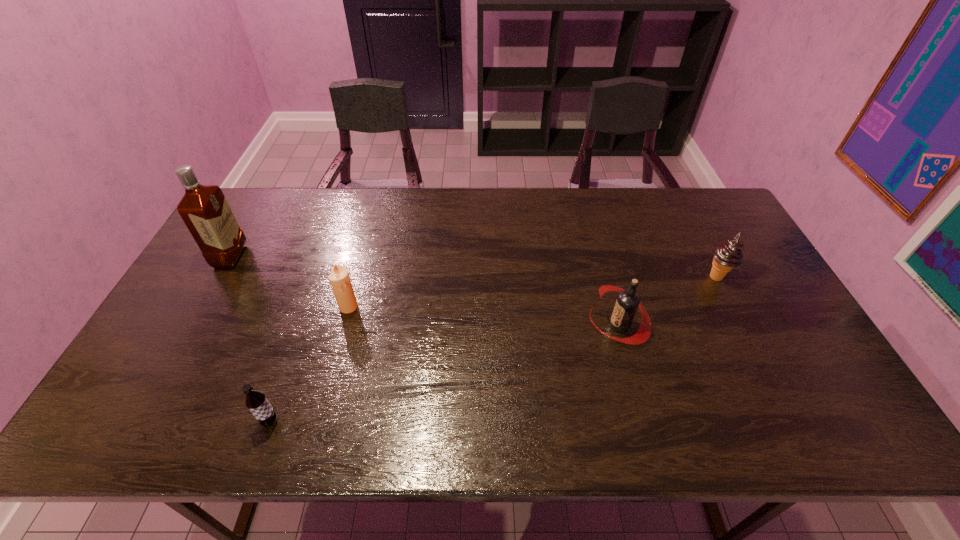
This screenshot has width=960, height=540. Identify the location of free spot between the nearer root beer and the tallest object. (251, 339).

At what (x,y) coordinates should I click in order to perform the action: click on vacant point located between the tallest object and the right root beer. Please return your answer as a coordinate pair (x, y). The image size is (960, 540). Looking at the image, I should click on (424, 291).

Locate an element on the screen. vacant area between the liquor and the rightmost object is located at coordinates (473, 267).

Identify which object is located as the third nearest to the leftmost object. Please provide its 2D coordinates. Your answer should be formatted as a tuple, i.e. [(x, y)], where the tuple contains the x and y coordinates of a point satisfying the conditions above.

[(627, 302)]

Select which object appears as the closest to the farther root beer. Please provide its 2D coordinates. Your answer should be formatted as a tuple, i.e. [(x, y)], where the tuple contains the x and y coordinates of a point satisfying the conditions above.

[(728, 255)]

In order to click on free space that satisfies the following two spatial constraints: 1. on the front label of the tallest object; 2. on the back side of the nearest object in this screenshot , I will do `click(136, 421)`.

Find the location of a particular element. This screenshot has height=540, width=960. vacant space that satisfies the following two spatial constraints: 1. on the back side of the rightmost object; 2. on the right side of the nearer root beer is located at coordinates [x=321, y=277].

This screenshot has width=960, height=540. In order to click on free point that satisfies the following two spatial constraints: 1. on the front label of the icecream; 2. on the right side of the tallest object in this screenshot , I will do [x=219, y=277].

Locate an element on the screen. free space that satisfies the following two spatial constraints: 1. on the back side of the rightmost object; 2. on the right side of the third object from right to left is located at coordinates tap(357, 277).

You are a GUI agent. You are given a task and a screenshot of the screen. Output one action in this format:
    pyautogui.click(x=<x>, y=<y>)
    Task: Click on the free region that satisfies the following two spatial constraints: 1. on the front label of the tallest object; 2. on the left side of the rightmost object
    
    Given the screenshot: What is the action you would take?
    pyautogui.click(x=219, y=277)